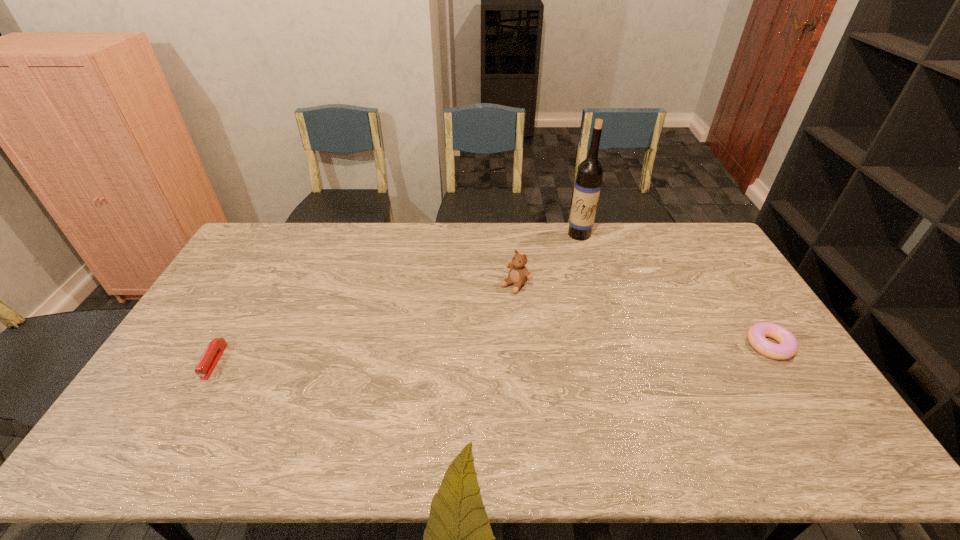
The height and width of the screenshot is (540, 960). I want to click on stapler, so click(207, 363).

This screenshot has width=960, height=540. What are the coordinates of `the rightmost object` in the screenshot? It's located at (788, 345).

Where is `wine bottle`? This screenshot has height=540, width=960. wine bottle is located at coordinates (587, 188).

The width and height of the screenshot is (960, 540). I want to click on the tallest object, so click(587, 188).

The image size is (960, 540). I want to click on the third nearest object, so click(x=518, y=274).

What are the coordinates of `the third shortest object` in the screenshot? It's located at (518, 274).

Locate an element on the screen. This screenshot has height=540, width=960. free space located on the front-facing side of the stapler is located at coordinates (187, 410).

The height and width of the screenshot is (540, 960). I want to click on vacant region located 0.260m on the left of the doughnut, so click(x=658, y=345).

Locate an element on the screen. The height and width of the screenshot is (540, 960). vacant space located 0.290m on the label of the third object from left to right is located at coordinates (557, 288).

Locate an element on the screen. This screenshot has width=960, height=540. vacant space located 0.240m on the label of the third object from left to right is located at coordinates (561, 279).